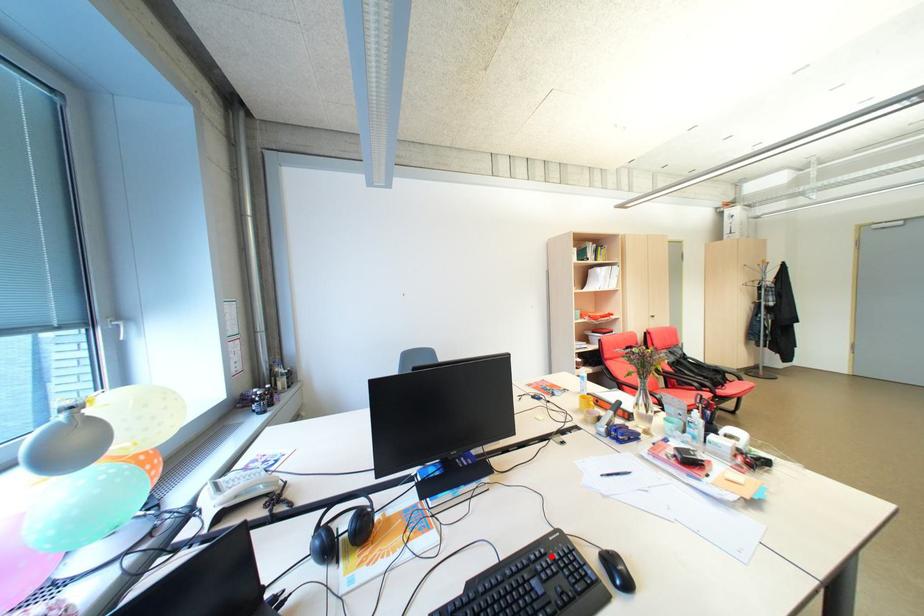
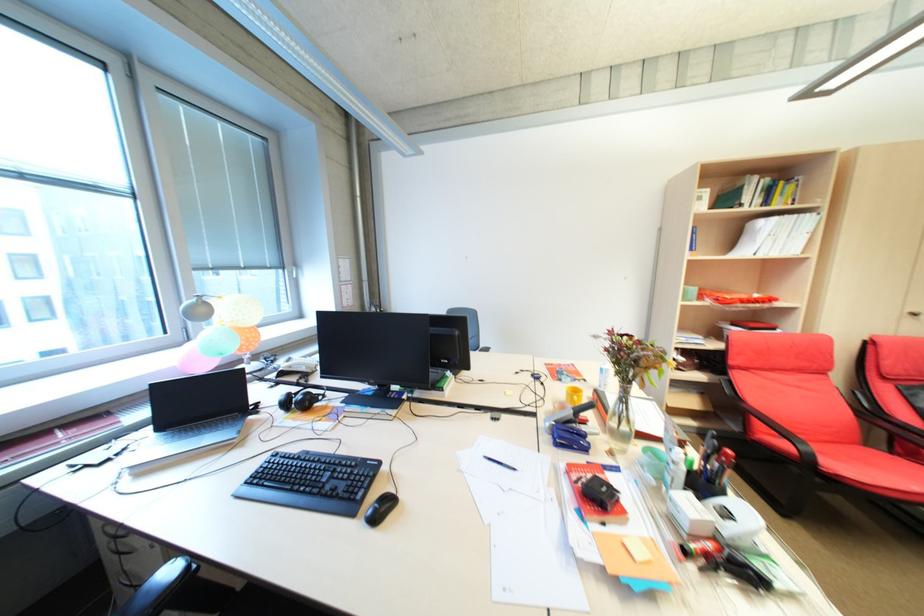
The point at the highlighted location is marked in the first image. Where is the corresponding point in the second image?

(359, 467)